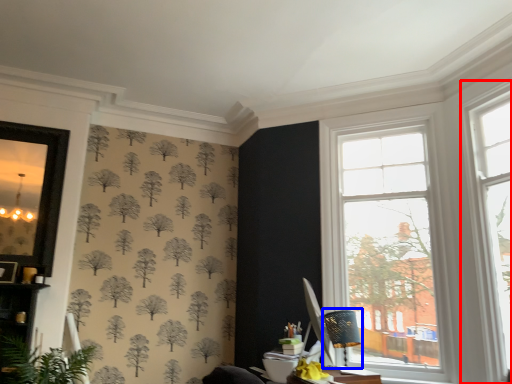
Question: Which object is closer to the camera taking this photo, window (highlighted by a red box) or table lamp (highlighted by a blue box)?

Choices:
 (A) window
 (B) table lamp

Answer: (A)